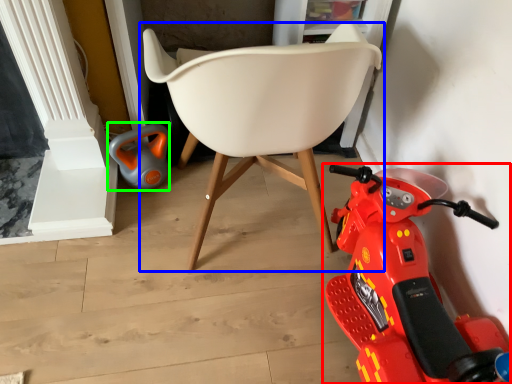
Question: Which object is the closest to the land vehicle (highlighted by a red box)? Choose among these: chair (highlighted by a blue box) or toy (highlighted by a green box).

Choices:
 (A) chair
 (B) toy

Answer: (A)